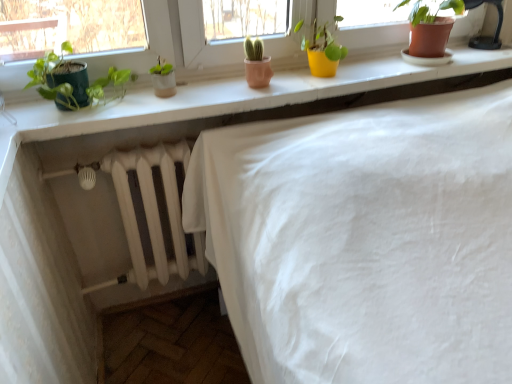
Question: Is point (69, 91) positioned closer to the camera than point (196, 92)?

Choices:
 (A) closer
 (B) farther

Answer: (A)

Question: From the image's perspective, is green matte pot at left, acting as the 3th houseplant starting from the right, above or below matte white windowsill at upper center?

Choices:
 (A) above
 (B) below

Answer: (B)

Question: Based on their relative distances, which object is nearer to the yellow matte pot at upper center, which is the second houseplant in right-to-left order?

Choices:
 (A) matte white windowsill at upper center
 (B) terracotta clay pot at upper right, arranged as the 3th houseplant when viewed from the left
 (C) green matte pot at left, acting as the 3th houseplant starting from the right

Answer: (A)

Question: Which of these objects is positioned closest to the green matte pot at left, the 1th houseplant in the left-to-right sequence?

Choices:
 (A) terracotta clay pot at upper right, which is the first houseplant in right-to-left order
 (B) yellow matte pot at upper center, which is counted as the 2th houseplant, starting from the left
 (C) matte white windowsill at upper center

Answer: (C)